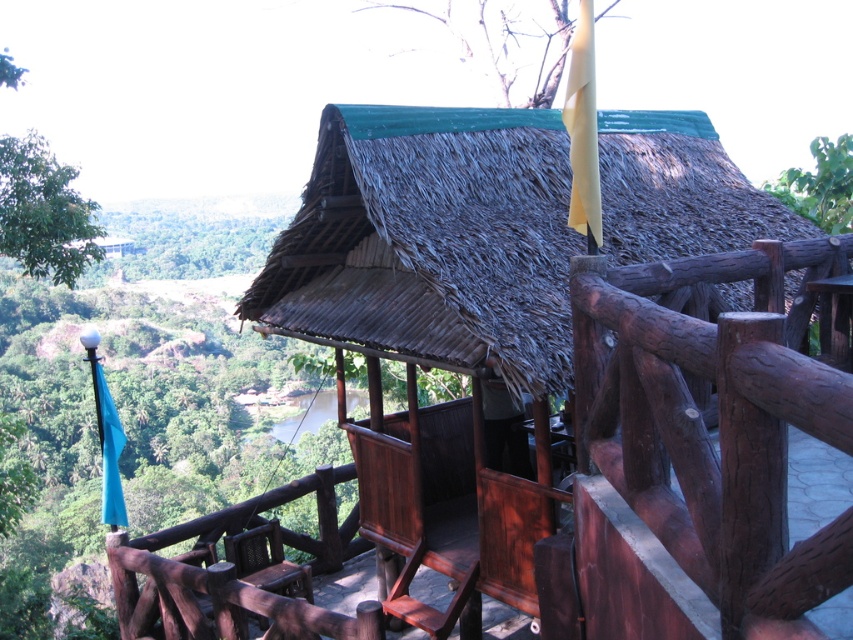
Does green thatch roof at center appear over green leafy tree at upper right?

Incorrect, green thatch roof at center is not positioned above green leafy tree at upper right.

Is point (426, 128) closer to viewer compared to point (846, 147)?

Yes, point (426, 128) is closer to viewer.

Between point (372, 282) and point (851, 147), which one is positioned behind?

The point (851, 147) is behind.

Where is `green thatch roof at center`? green thatch roof at center is located at coordinates (432, 240).

Does brown wood/rustic rail at center-right appear on the right side of green leafy tree at upper left?

Yes, brown wood/rustic rail at center-right is to the right of green leafy tree at upper left.

Who is shorter, brown wood/rustic rail at center-right or green leafy tree at upper left?

brown wood/rustic rail at center-right is shorter.

Image resolution: width=853 pixels, height=640 pixels. What do you see at coordinates (718, 428) in the screenshot?
I see `brown wood/rustic rail at center-right` at bounding box center [718, 428].

Where is `brown wood/rustic rail at center-right`? brown wood/rustic rail at center-right is located at coordinates (718, 428).

Does green thatch roof at center have a lesser height compared to brown wood/rustic rail at center-right?

Yes.

Which is in front, point (490, 349) or point (821, 378)?

Point (821, 378) is in front.

Between point (367, 180) and point (598, 266), which one is positioned in front?

Point (598, 266) is in front.

This screenshot has height=640, width=853. I want to click on green thatch roof at center, so click(432, 240).